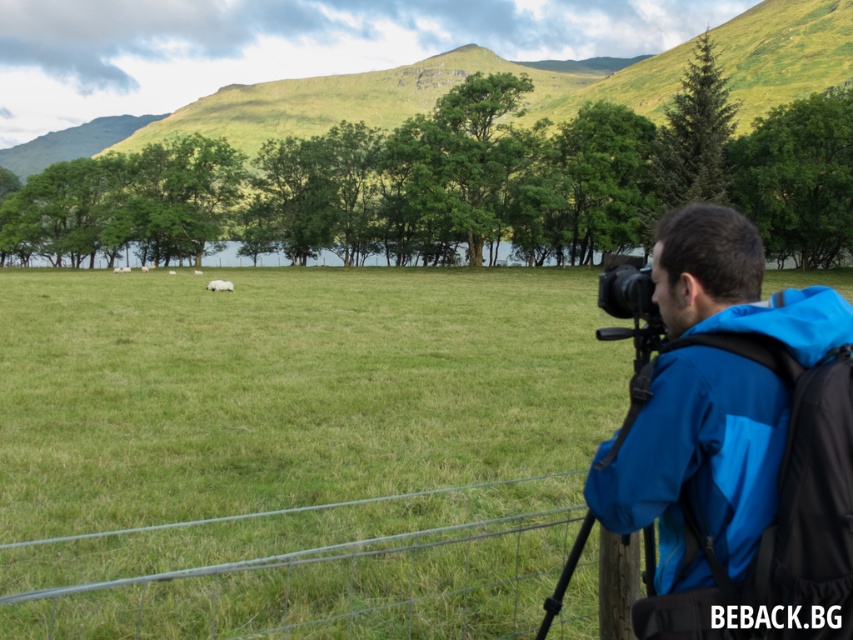
You are standing at the point marked as point (288, 387) in the image. What is the immediate terrain you are standing on?

The immediate terrain at point (288, 387) is green grassy field at center.

You are a hiker who has just set up your equipment. You need to retrieve your black plastic camera at right to take a photo. Which direction should you move relative to your blue fabric backpack at right?

The blue fabric backpack at right is to the left of the black plastic camera at right. Therefore, to retrieve the black plastic camera at right, you should move to the right from the blue fabric backpack at right.